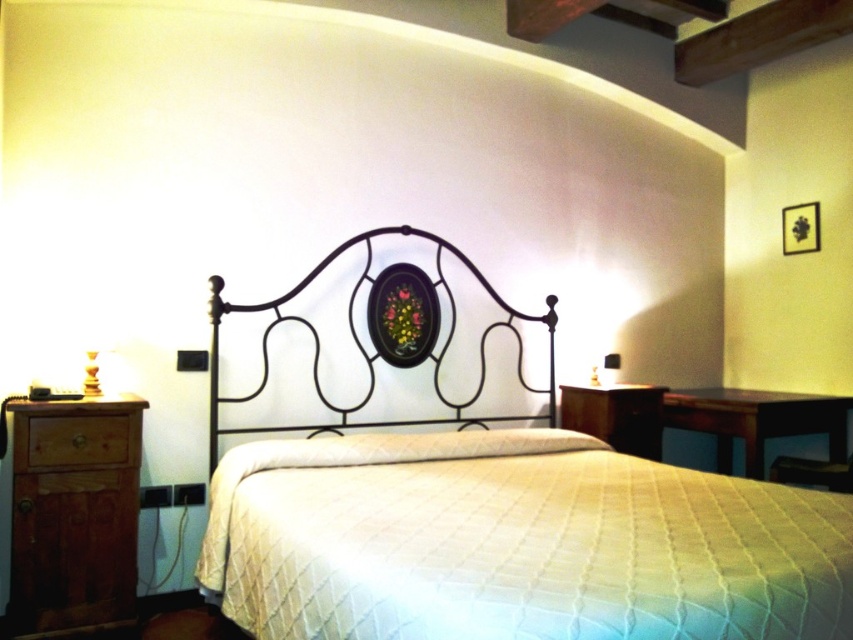
From the picture: Does iron/metallic headboard at center appear on the right side of white quilted pillow at center?

No, iron/metallic headboard at center is not to the right of white quilted pillow at center.

Which of these two, iron/metallic headboard at center or white quilted pillow at center, stands shorter?

With less height is white quilted pillow at center.

Between point (213, 296) and point (469, 448), which one is positioned in front?

Point (213, 296) is more forward.

You are a GUI agent. You are given a task and a screenshot of the screen. Output one action in this format:
    pyautogui.click(x=<x>, y=<y>)
    Task: Click on the iron/metallic headboard at center
    This screenshot has height=640, width=853.
    Given the screenshot: What is the action you would take?
    pyautogui.click(x=383, y=337)

Does white quilted pillow at center have a lesser width compared to wooden lamp at right?

In fact, white quilted pillow at center might be wider than wooden lamp at right.

Is point (485, 444) positioned after point (606, 355)?

No, (485, 444) is closer to viewer.

This screenshot has height=640, width=853. Find the location of `white quilted pillow at center`. white quilted pillow at center is located at coordinates (395, 449).

Who is shorter, iron/metallic headboard at center or wooden lamp at right?

wooden lamp at right is shorter.

Between iron/metallic headboard at center and wooden lamp at right, which one has more height?

iron/metallic headboard at center is taller.

Does point (430, 344) come farther from viewer compared to point (602, 365)?

That is False.

This screenshot has width=853, height=640. I want to click on iron/metallic headboard at center, so click(x=383, y=337).